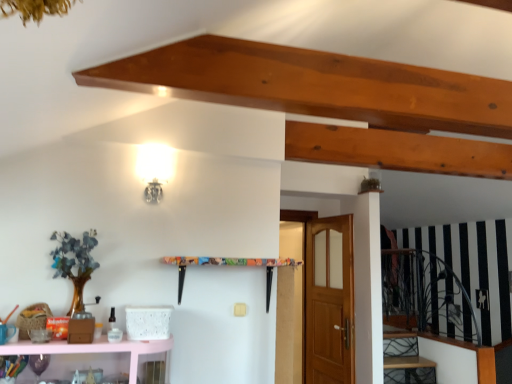
Question: Is wooden stairwell at lower right bigger or smaller than pink glossy shelf at lower left?

Choices:
 (A) big
 (B) small

Answer: (B)

Question: Based on their positions, is wooden stairwell at lower right located to the left or right of pink glossy shelf at lower left?

Choices:
 (A) right
 (B) left

Answer: (A)

Question: Which is nearer to the wooden stairwell at lower right?

Choices:
 (A) wooden door at center
 (B) pink glossy shelf at lower left

Answer: (A)

Question: Estimate the real-world distances between objects in this image. Which object is closer to the pink glossy shelf at lower left?

Choices:
 (A) wooden stairwell at lower right
 (B) wooden door at center

Answer: (B)